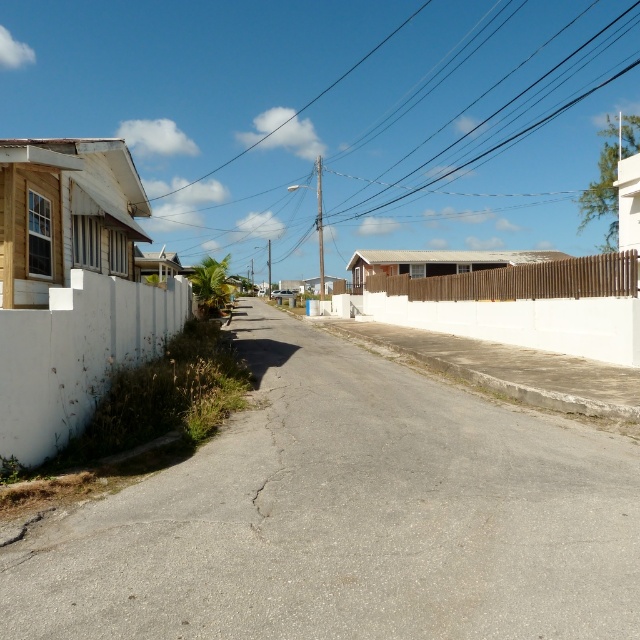
Question: Is black wire at upper center positioned at the back of white wooden fence at center?

Choices:
 (A) yes
 (B) no

Answer: (A)

Question: Which of the following is the farthest from the observer?

Choices:
 (A) (609, 257)
 (B) (550, 29)

Answer: (B)

Question: Among these objects, which one is nearest to the camera?

Choices:
 (A) brown wooden fence at center
 (B) black wire at upper center

Answer: (A)

Question: Does black wire at upper center have a smaller size compared to white wooden fence at center?

Choices:
 (A) yes
 (B) no

Answer: (B)

Question: Based on their relative distances, which object is nearer to the brown wooden fence at center?

Choices:
 (A) black wire at upper center
 (B) white wooden fence at center

Answer: (B)

Question: Is black wire at upper center positioned in front of brown wooden fence at center?

Choices:
 (A) yes
 (B) no

Answer: (B)